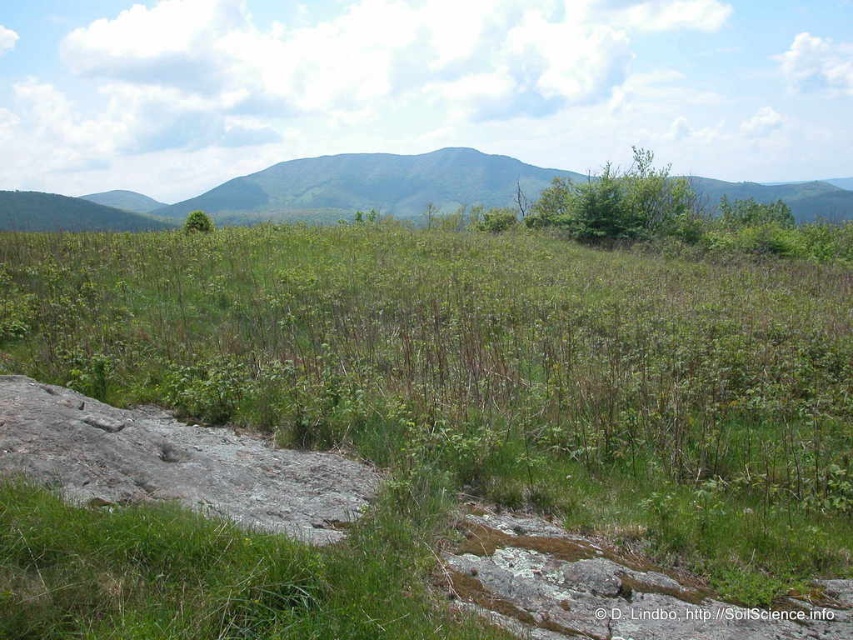
Based on the photo, can you confirm if green grassy at center is positioned to the left of gray rough rock at lower left?

In fact, green grassy at center is to the right of gray rough rock at lower left.

Is green grassy at center wider than gray rough rock at lower left?

Yes, green grassy at center is wider than gray rough rock at lower left.

The image size is (853, 640). Identify the location of green grassy at center. (485, 371).